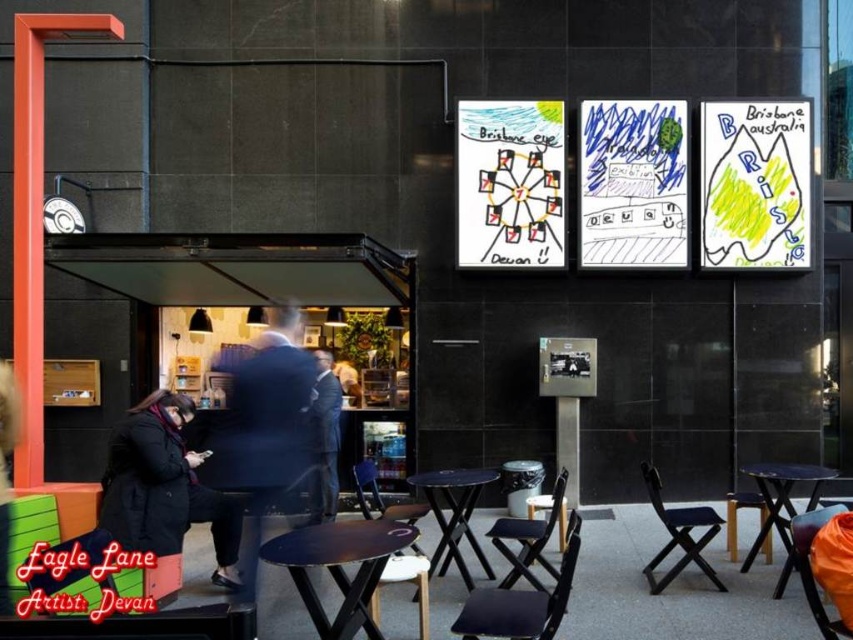
You are standing at point (318, 621) and want to walk to the middle artwork on the wall. The path is clear. How far will you have to walk?

You will have to walk 4.43 meters to reach the middle artwork on the wall from point (318, 621).

You are a guest at a cafe and see the black wool coat at lower left and the black plastic table at center. Which item is located to the left of the other?

The black wool coat at lower left is positioned on the left side of black plastic table at center.

You are standing in the outdoor seating area and want to place a small potted plant between the two points, point 1 at point (339, 540) and point 2 at point (381, 508). Since the plant needs to be closer to the viewer, which point should you choose to place it near?

You should place the potted plant near point 1 at point (339, 540) because it is closer to the viewer compared to point 2 at point (381, 508).